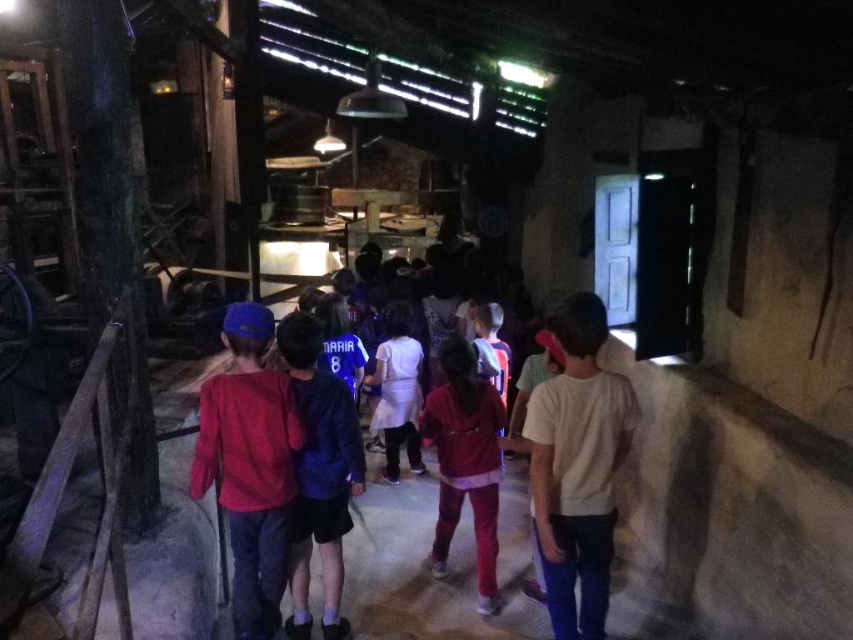
You are one of the children in the group walking through the industrial setting. You notice two points marked on the floor ahead of you. The first point is at coordinate point (x=262, y=596) and the second is at point (x=341, y=413). Which point is closer to you as you walk forward?

Point (x=341, y=413) is closer to you because point (x=262, y=596) is behind it.

You are a photographer trying to capture a group shot of the children in the industrial setting. You notice the white matte shirt at center and the velvet red jacket at center. Which child should you focus on to ensure they appear larger in the photo?

The white matte shirt at center should be focused on because its width surpasses that of the velvet red jacket at center, making it appear larger in the photo.